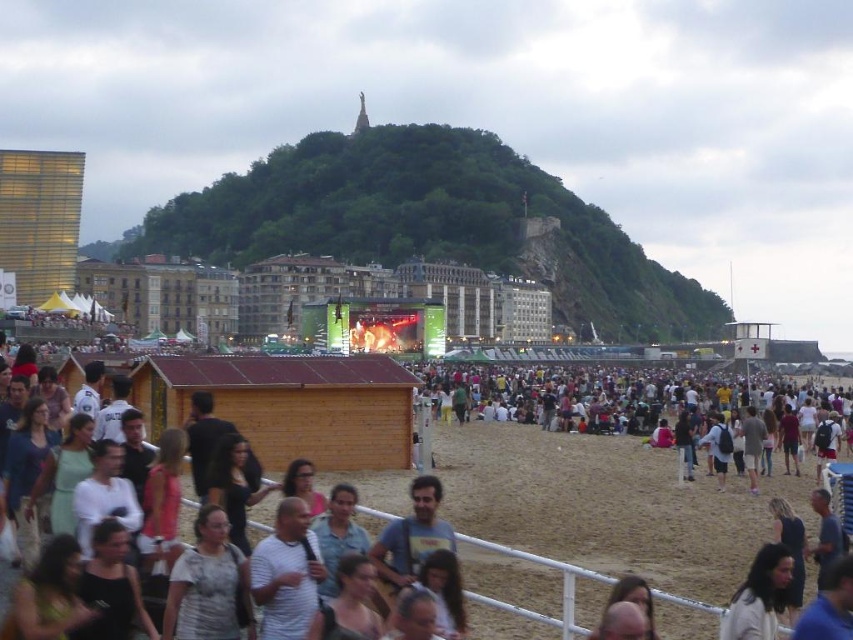
Does point (241, 392) lie behind point (709, 467)?

No.

Between point (364, 449) and point (556, 387), which one is positioned behind?

The point (556, 387) is more distant.

Describe the element at coordinates (291, 404) in the screenshot. I see `wooden hut at center` at that location.

Locate an element on the screen. Image resolution: width=853 pixels, height=640 pixels. wooden hut at center is located at coordinates (291, 404).

Between point (257, 413) and point (735, 612), which one is positioned in front?

Point (735, 612) is in front.

Does wooden hut at center have a greater height compared to light brown hair at lower right?

Yes.

Is point (393, 408) positioned before point (792, 557)?

No, it is behind (792, 557).

I want to click on wooden hut at center, so click(291, 404).

Between dark brown sand at center and light brown hair at lower right, which one appears on the left side from the viewer's perspective?

light brown hair at lower right

Between dark brown sand at center and light brown hair at lower right, which one appears on the right side from the viewer's perspective?

dark brown sand at center is more to the right.

Between point (709, 396) and point (746, 609), which one is positioned behind?

The point (709, 396) is more distant.

Image resolution: width=853 pixels, height=640 pixels. In order to click on dark brown sand at center in this screenshot , I will do `click(650, 416)`.